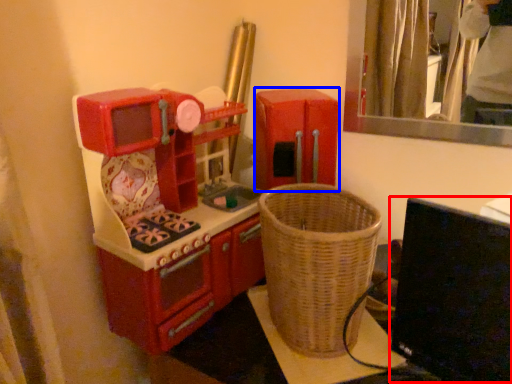
Question: Which point is closer to the camera, computer monitor (highlighted by a red box) or appliance (highlighted by a blue box)?

Choices:
 (A) computer monitor
 (B) appliance

Answer: (A)